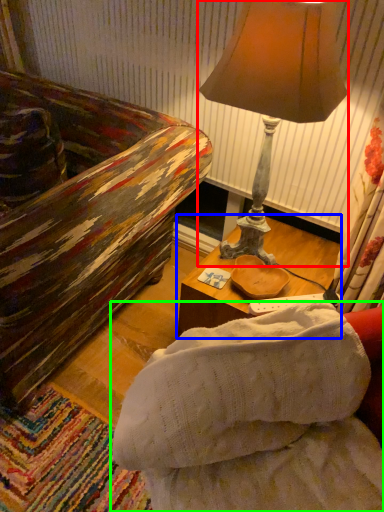
Question: Which object is the farthest from lamp (highlighted by a red box)? Choose among these: table (highlighted by a blue box) or studio couch (highlighted by a green box).

Choices:
 (A) table
 (B) studio couch

Answer: (B)